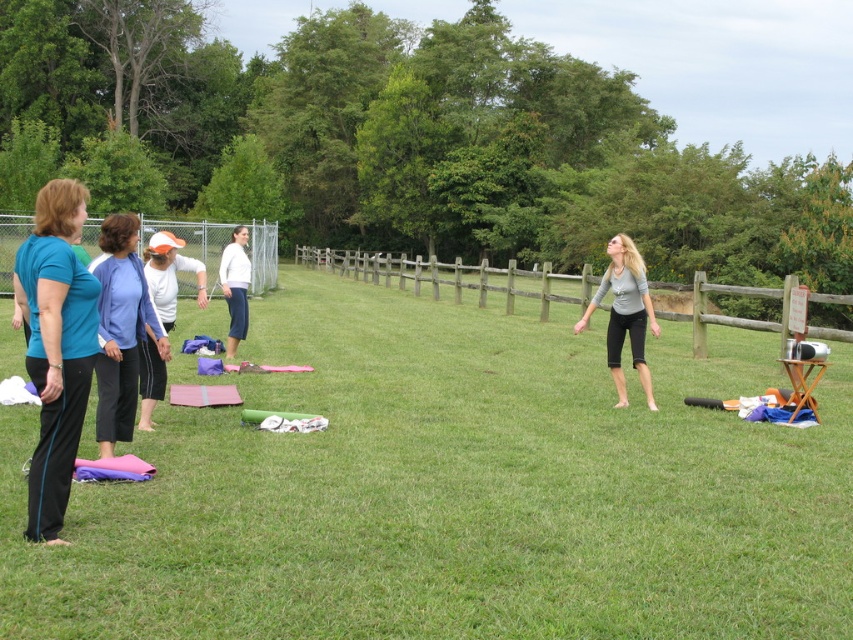
Question: Observing the image, what is the correct spatial positioning of teal matte shirt at left in reference to white cotton shirt at center-left?

Choices:
 (A) left
 (B) right

Answer: (B)

Question: Which point is farther from the camera taking this photo?

Choices:
 (A) (93, 326)
 (B) (721, 320)

Answer: (B)

Question: Does wooden fence at center appear under white cotton shirt at center-left?

Choices:
 (A) yes
 (B) no

Answer: (B)

Question: Which is farther from the gray matte leggings at right?

Choices:
 (A) wooden fence at center
 (B) white cotton shirt at center-left

Answer: (A)

Question: Which of the following is the farthest from the observer?

Choices:
 (A) teal matte shirt at left
 (B) gray matte leggings at right
 (C) blue cotton sweater at left

Answer: (B)

Question: Is green grass at center wider than white matte pants at center?

Choices:
 (A) yes
 (B) no

Answer: (A)